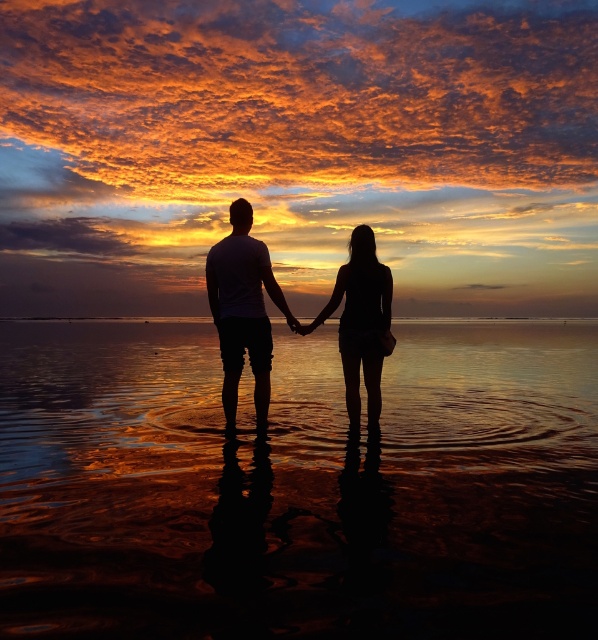
You are a photographer trying to capture the sunset scene. You notice the reflective wet sand at center and the black matte shorts at center. Which object is positioned lower in the image?

The reflective wet sand at center is located below black matte shorts at center, so the reflective wet sand at center is positioned lower in the image.

You are standing on the shore and want to walk towards the two figures holding hands in the reflective wet sand at center. Which direction should you walk to reach them?

You should walk towards the reflective wet sand at center, which is located at point (297,484). Since the figures are standing there, walking towards that coordinate will lead you directly to them.